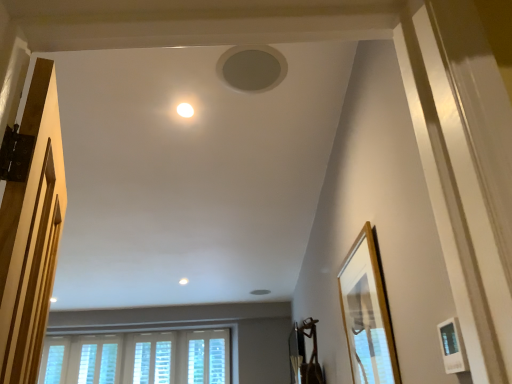
Question: Can you confirm if white textured window at lower left, which appears as the second window when viewed from the left, is thinner than white textured blinds at lower center, the third window from the left?

Choices:
 (A) yes
 (B) no

Answer: (A)

Question: Are white textured window at lower left, which ranks as the third window in right-to-left order, and white textured blinds at lower center, the third window from the left, far apart?

Choices:
 (A) yes
 (B) no

Answer: (B)

Question: From the image's perspective, would you say white textured window at lower left, which appears as the second window when viewed from the left, is shown under white textured blinds at lower center, which ranks as the 2th window in right-to-left order?

Choices:
 (A) yes
 (B) no

Answer: (B)

Question: From a real-world perspective, is white textured window at lower left, which appears as the second window when viewed from the left, beneath white textured blinds at lower center, the third window from the left?

Choices:
 (A) yes
 (B) no

Answer: (B)

Question: Considering the relative sizes of white textured window at lower left, which appears as the second window when viewed from the left, and white textured blinds at lower center, which ranks as the 2th window in right-to-left order, in the image provided, is white textured window at lower left, which appears as the second window when viewed from the left, bigger than white textured blinds at lower center, which ranks as the 2th window in right-to-left order,?

Choices:
 (A) yes
 (B) no

Answer: (B)

Question: In the image, is matte gray speaker at upper center, which appears as the 1th hole when viewed from the top, positioned in front of or behind white textured window at lower center, arranged as the 1th window when viewed from the right?

Choices:
 (A) behind
 (B) front

Answer: (B)

Question: From their relative heights in the image, would you say matte gray speaker at upper center, which appears as the 1th hole when viewed from the top, is taller or shorter than white textured window at lower center, arranged as the 1th window when viewed from the right?

Choices:
 (A) short
 (B) tall

Answer: (A)

Question: In the image, is matte gray speaker at upper center, which ranks as the 2th hole in bottom-to-top order, on the left side or the right side of white textured window at lower center, acting as the fourth window starting from the left?

Choices:
 (A) right
 (B) left

Answer: (A)

Question: From a real-world perspective, relative to white textured window at lower center, arranged as the 1th window when viewed from the right, is matte gray speaker at upper center, acting as the second hole starting from the back, vertically above or below?

Choices:
 (A) above
 (B) below

Answer: (A)

Question: Is white textured window at lower left, which ranks as the third window in right-to-left order, wider or thinner than white matte picture frame at lower right, arranged as the 2th picture frame when viewed from the back?

Choices:
 (A) thin
 (B) wide

Answer: (B)

Question: From the image's perspective, is white textured window at lower left, which ranks as the third window in right-to-left order, above or below white matte picture frame at lower right, which ranks as the 1th picture frame in front-to-back order?

Choices:
 (A) above
 (B) below

Answer: (B)

Question: In the image, is white textured window at lower left, which appears as the second window when viewed from the left, positioned in front of or behind white matte picture frame at lower right, arranged as the 2th picture frame when viewed from the back?

Choices:
 (A) behind
 (B) front

Answer: (A)

Question: Would you say white textured window at lower left, which appears as the second window when viewed from the left, is inside or outside white matte picture frame at lower right, arranged as the 2th picture frame when viewed from the back?

Choices:
 (A) inside
 (B) outside

Answer: (B)

Question: Is white textured window at lower center, acting as the fourth window starting from the left, spatially inside white matte picture frame at lower right, which ranks as the 1th picture frame in front-to-back order, or outside of it?

Choices:
 (A) outside
 (B) inside

Answer: (A)

Question: In the image, is white textured window at lower center, arranged as the 1th window when viewed from the right, positioned in front of or behind white matte picture frame at lower right, which ranks as the 1th picture frame in front-to-back order?

Choices:
 (A) front
 (B) behind

Answer: (B)